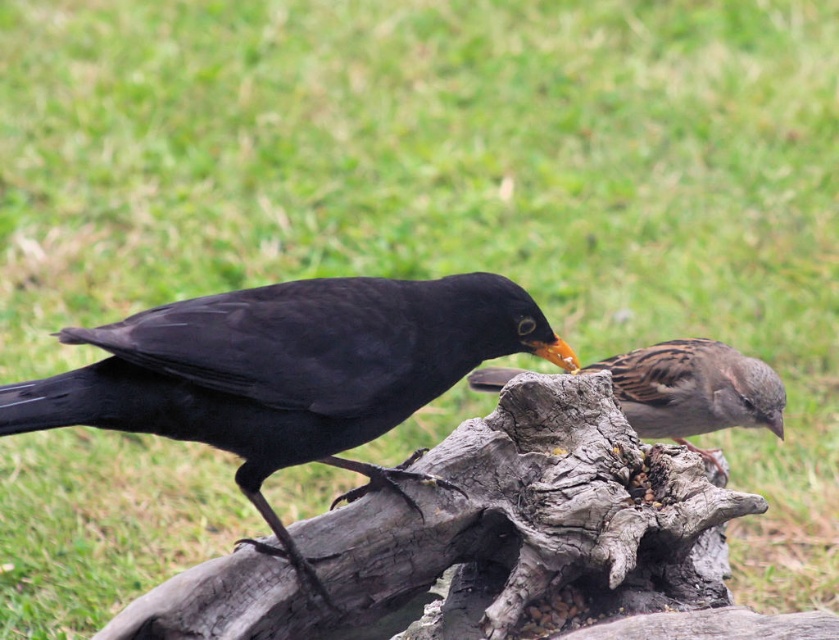
You are a birdwatcher observing the two birds in the scene. Which bird is taller, the brown speckled sparrow at right or the brown speckled feathers at center?

The brown speckled sparrow at right is much taller than the brown speckled feathers at center.

You are a birdwatcher observing two birds on a driftwood. You see the brown speckled sparrow at right and the brown speckled feathers at center. Which bird has a larger width?

The brown speckled sparrow at right has a larger width than the brown speckled feathers at center according to the description.